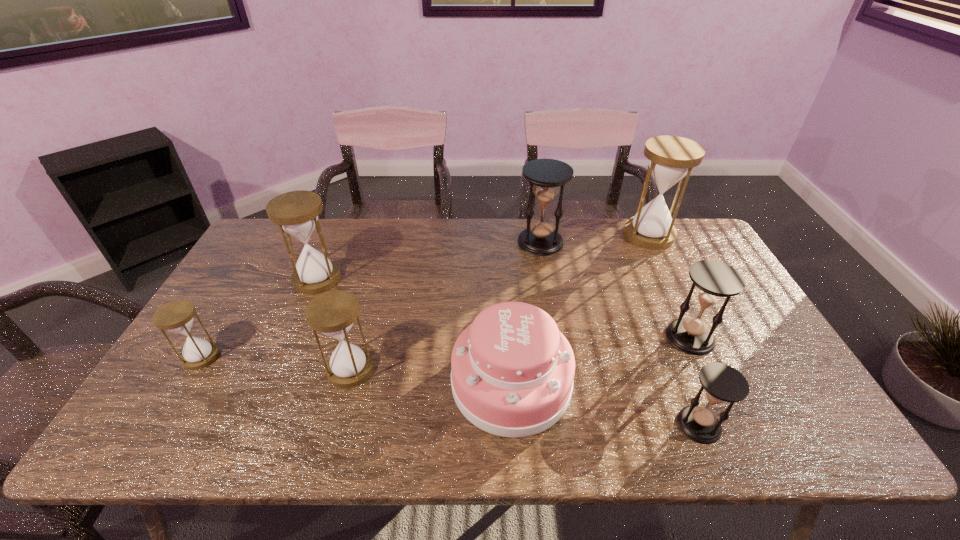
Locate an element on the screen. The width and height of the screenshot is (960, 540). hourglass that is the fifth closest to the pink birthday cake is located at coordinates (296, 212).

Locate an element on the screen. the sixth closest hourglass to the tallest object is located at coordinates (177, 316).

In order to click on the closest white hourglass relative to the tallest hourglass in this screenshot , I will do `click(332, 313)`.

Point out which white hourglass is positioned as the second nearest to the smallest black hourglass. Please provide its 2D coordinates. Your answer should be formatted as a tuple, i.e. [(x, y)], where the tuple contains the x and y coordinates of a point satisfying the conditions above.

[(332, 313)]

Where is `the closest black hourglass to the nearest hourglass`? This screenshot has width=960, height=540. the closest black hourglass to the nearest hourglass is located at coordinates (714, 280).

Point out which black hourglass is positioned as the nearest to the third farthest object. Please provide its 2D coordinates. Your answer should be formatted as a tuple, i.e. [(x, y)], where the tuple contains the x and y coordinates of a point satisfying the conditions above.

[(545, 176)]

The height and width of the screenshot is (540, 960). I want to click on blank space that satisfies the following two spatial constraints: 1. on the front side of the fifth hourglass from right to left; 2. on the right side of the third farthest hourglass, so click(279, 369).

The image size is (960, 540). What are the coordinates of `free space that satisfies the following two spatial constraints: 1. on the front side of the third biggest white hourglass; 2. on the right side of the sixth hourglass from right to left` in the screenshot? It's located at (279, 369).

This screenshot has height=540, width=960. I want to click on free space in the image that satisfies the following two spatial constraints: 1. on the front side of the fifth hourglass from right to left; 2. on the right side of the second white hourglass from left to right, so click(x=279, y=369).

Find the location of a particular element. This screenshot has width=960, height=540. free space that satisfies the following two spatial constraints: 1. on the back side of the tallest hourglass; 2. on the right side of the pink birthday cake is located at coordinates (502, 235).